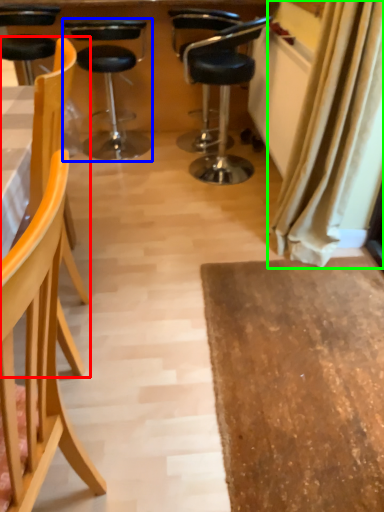
Question: Based on their relative distances, which object is nearer to chair (highlighted by a red box)? Choose from chair (highlighted by a blue box) and curtain (highlighted by a green box).

Choices:
 (A) chair
 (B) curtain

Answer: (B)